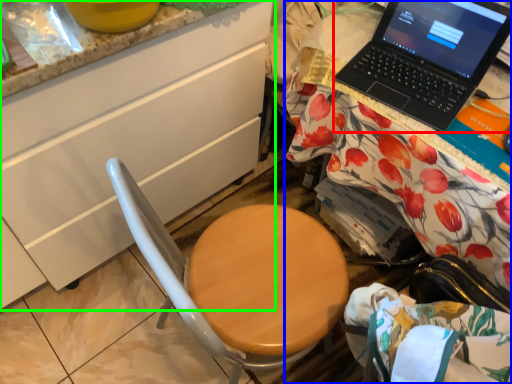
Question: Estimate the real-world distances between objects in this image. Which object is farther from laptop (highlighted by a red box), desk (highlighted by a blue box) or cabinetry (highlighted by a green box)?

Choices:
 (A) desk
 (B) cabinetry

Answer: (B)